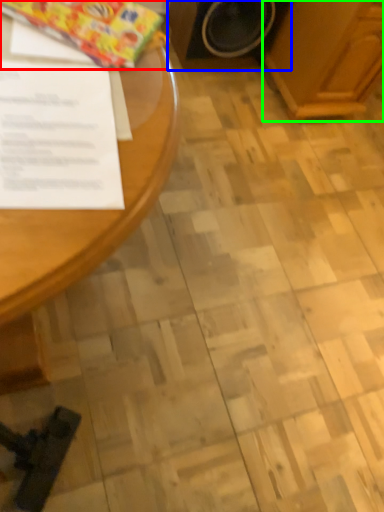
Question: Which object is positioned closest to wrapping paper (highlighted by a red box)? Select from appliance (highlighted by a blue box) and wood (highlighted by a green box).

Choices:
 (A) appliance
 (B) wood

Answer: (A)